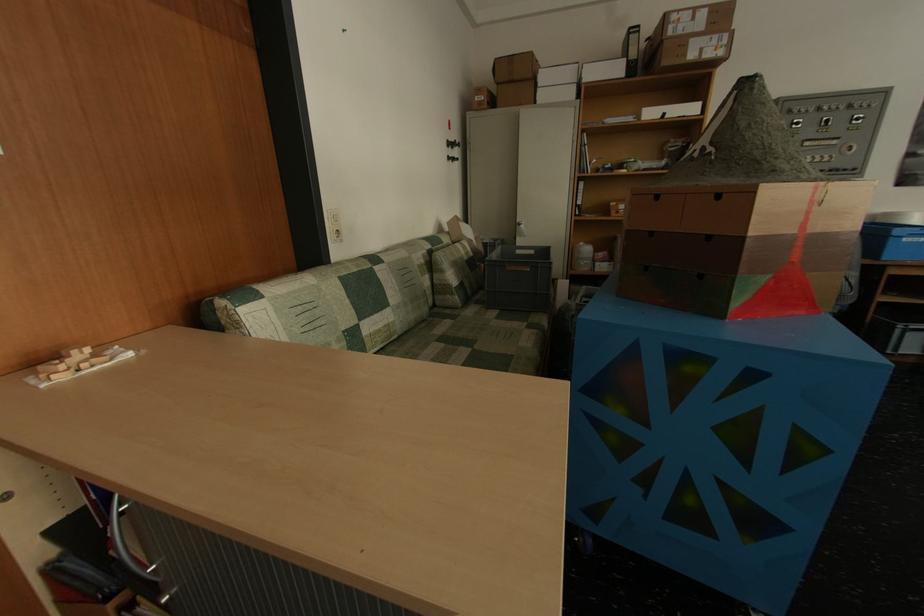
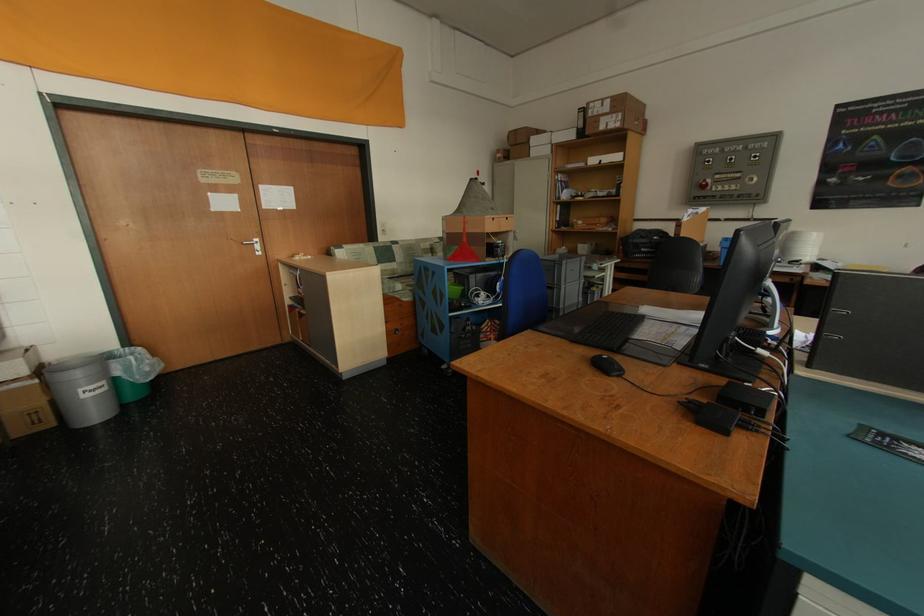
Locate, in the second image, the point that corresponds to [772,281] in the first image.

(465, 249)